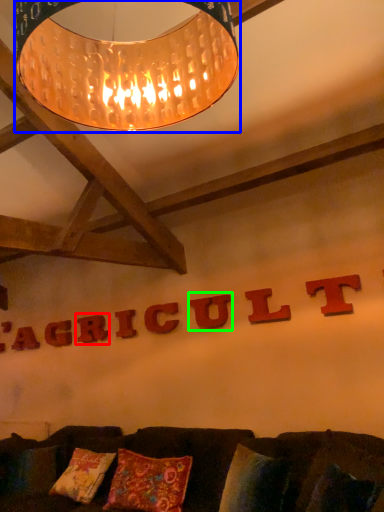
Question: Which object is positioned farthest from letter (highlighted by a red box)? Select from lamp (highlighted by a blue box) and letter (highlighted by a green box).

Choices:
 (A) lamp
 (B) letter

Answer: (A)